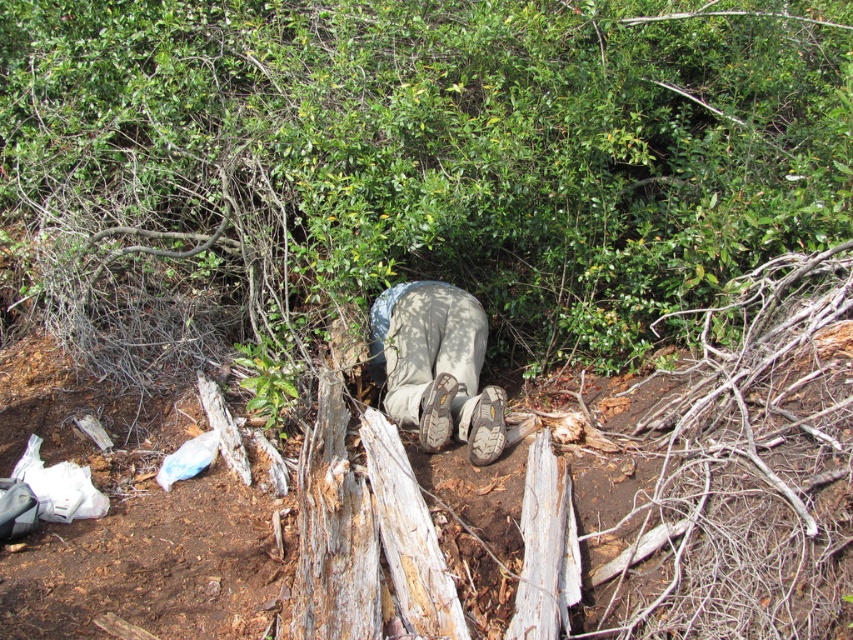
You are a hiker who has just come across a person lying on the forest floor. You notice two items near them. One is the brown suede boots at center, and the other is the brown suede shoe at center. Which item is closer to the person lying on the ground?

The brown suede shoe at center is closer to the person lying on the ground because the brown suede boots at center is located above it, meaning the shoe is underneath and nearer to the ground.

You are a hiker who has just finished a long trek and wants to rest. You spot the rough bark tree trunk at center and the brown suede shoe at lower center. Which object is closer to your right side if you face the tree trunk?

The brown suede shoe at lower center is to the right of the rough bark tree trunk at center, so if you face the tree trunk, the shoe would be on your right side.

You are a hiker who wants to lean against the rough bark tree trunk at center while resting your foot on the brown suede shoe at lower center. Is the tree trunk big enough to support your weight?

The rough bark tree trunk at center has a larger size compared to the brown suede shoe at lower center, so yes, the tree trunk is large enough to support your weight.